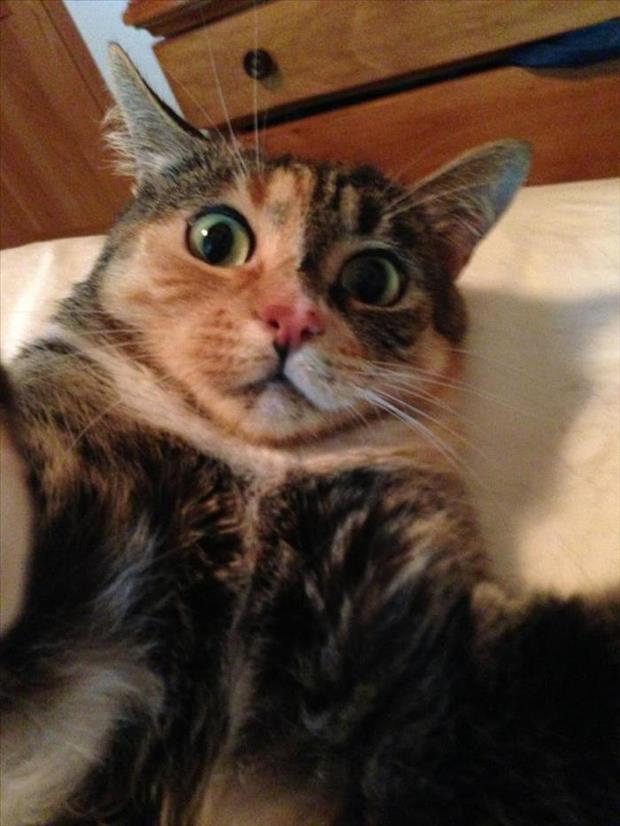
I want to click on dresser knob, so (255, 60).